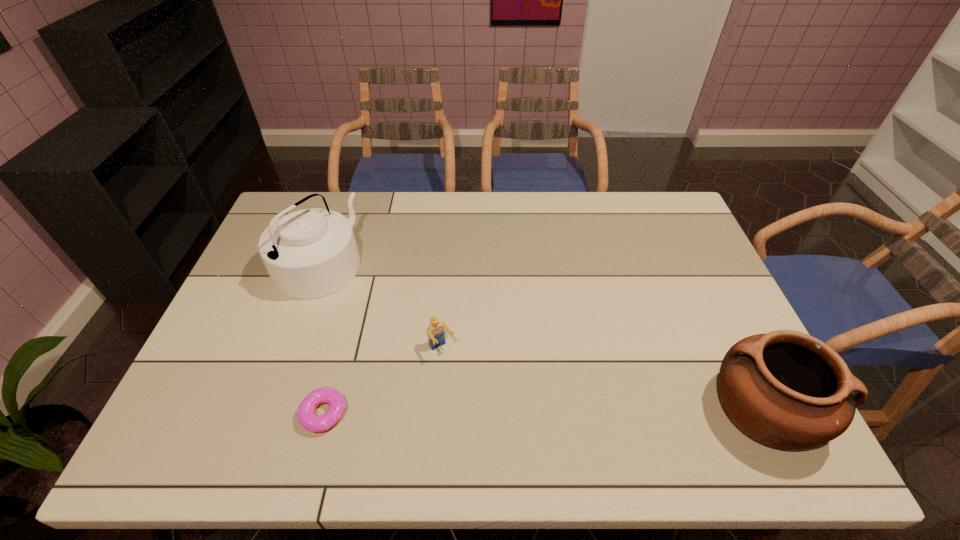
Locate an element on the screen. vacant space located on the spout of the tallest object is located at coordinates (371, 299).

Image resolution: width=960 pixels, height=540 pixels. Identify the location of free spot located 0.220m on the spout of the tallest object. (401, 317).

Identify the location of vacant space located 0.170m on the face of the third object from left to right. tap(486, 409).

Image resolution: width=960 pixels, height=540 pixels. Find the location of `free space located 0.150m on the face of the third object from left to right`. free space located 0.150m on the face of the third object from left to right is located at coordinates (481, 403).

The image size is (960, 540). Identify the location of vacant point located 0.090m on the face of the third object from left to right. (468, 384).

Identify the location of object that is at the far edge. (310, 253).

This screenshot has width=960, height=540. I want to click on doughnut at the near edge, so click(306, 416).

This screenshot has height=540, width=960. Find the location of `pottery located at the near edge`. pottery located at the near edge is located at coordinates (x=785, y=389).

Locate an element on the screen. object situated at the left edge is located at coordinates (310, 253).

Identify the location of object at the right edge. The width and height of the screenshot is (960, 540). (785, 389).